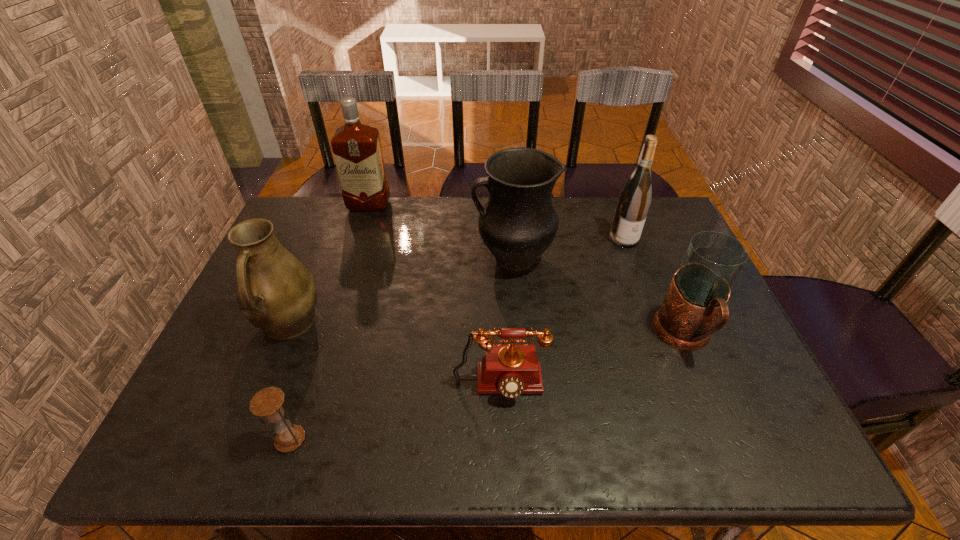
The image size is (960, 540). What are the coordinates of `vacant area that lies between the second shortest object and the leftmost pitcher` in the screenshot? It's located at (394, 355).

In order to click on unoccupied area between the farthest object and the rightmost pitcher in this screenshot , I will do `click(527, 271)`.

Image resolution: width=960 pixels, height=540 pixels. I want to click on vacant region between the second pitcher from right to left and the wine bottle, so click(x=568, y=248).

This screenshot has height=540, width=960. Identify the location of unoccupied area between the nearest object and the second pitcher from left to right. (401, 348).

In order to click on free space between the rightmost pitcher and the farthest object in this screenshot , I will do `click(527, 271)`.

What are the coordinates of `vacant area that lies between the second pitcher from right to left and the leftmost pitcher` in the screenshot? It's located at (400, 291).

The height and width of the screenshot is (540, 960). I want to click on free point between the rightmost pitcher and the farthest pitcher, so click(598, 296).

Locate an element on the screen. The image size is (960, 540). free space between the farthest object and the leftmost pitcher is located at coordinates click(328, 265).

Identify the location of free space between the wine bottle and the second shortest object. (562, 313).

Identify the location of object that is the second closest to the leftmost pitcher. (511, 370).